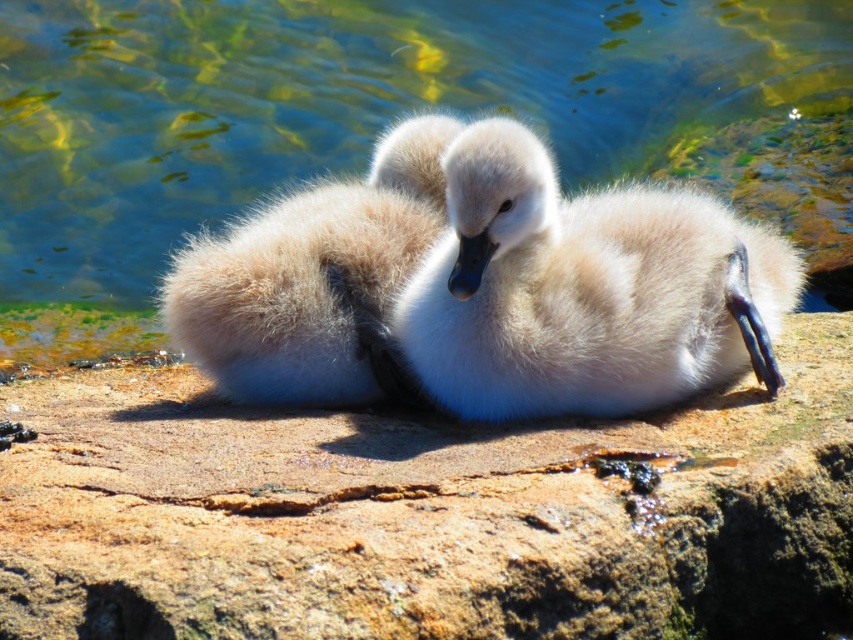
From the picture: You are a parent swan watching over your cygnets. You notice the translucent water at center and the white fluffy duckling at center. Which one is positioned higher from your viewpoint?

The translucent water at center is located above the white fluffy duckling at center, so the translucent water at center is positioned higher from your viewpoint.

You are a photographer trying to capture the cygnets in the image. You want to place a marker at point (428, 515) to mark the best spot for lighting. According to the scene description, what type of surface is at that point?

The point (428, 515) is on a brown rough stone at center, which is a solid and stable surface suitable for placing a lighting marker.